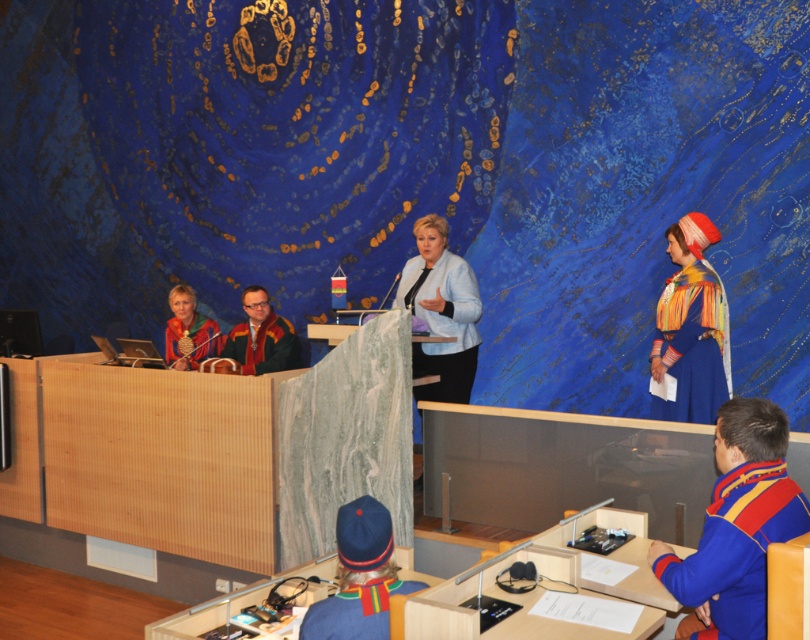
Question: Considering the relative positions of blue velvet dress at right and matte red leather bag at left in the image provided, where is blue velvet dress at right located with respect to matte red leather bag at left?

Choices:
 (A) right
 (B) left

Answer: (A)

Question: Can you confirm if blue woolen sweater at lower right is wider than light blue fabric jacket at center?

Choices:
 (A) yes
 (B) no

Answer: (B)

Question: Which point appears farthest from the camera in this image?

Choices:
 (A) (309, 608)
 (B) (691, 588)
 (C) (438, 264)
 (D) (173, 333)

Answer: (D)

Question: Which point is closer to the camera taking this photo?

Choices:
 (A) (229, 340)
 (B) (178, 348)
 (C) (467, 276)

Answer: (C)

Question: Based on their relative distances, which object is nearer to the light blue fabric jacket at center?

Choices:
 (A) velvet maroon robe at center
 (B) matte red leather bag at left
 (C) blue velvet dress at right
 (D) blue fabric hat at lower center

Answer: (A)

Question: Is blue woolen sweater at lower right behind matte red leather bag at left?

Choices:
 (A) yes
 (B) no

Answer: (B)